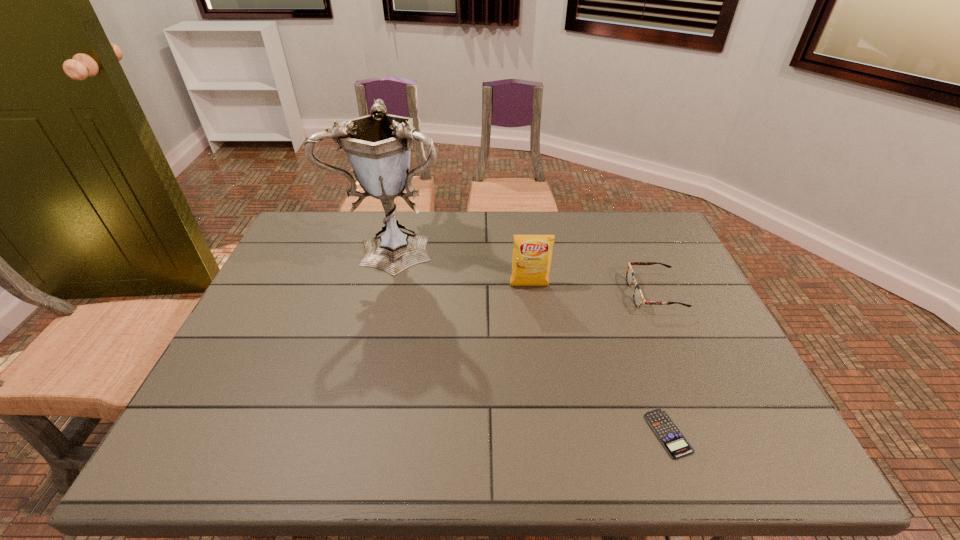
This screenshot has width=960, height=540. In the image, there is a desktop. In order to click on vacant space at the far right corner in this screenshot , I will do `click(651, 216)`.

You are a GUI agent. You are given a task and a screenshot of the screen. Output one action in this format:
    pyautogui.click(x=<x>, y=<y>)
    Task: Click on the free point between the leftmost object and the second object from left to right
    The width and height of the screenshot is (960, 540).
    Given the screenshot: What is the action you would take?
    pyautogui.click(x=463, y=265)

Identify the location of free spot between the calculator and the third object from right to left. (599, 360).

Find the location of a particular element. The image size is (960, 540). free point between the spectacles and the third shortest object is located at coordinates (591, 289).

The image size is (960, 540). Find the location of `vacant area that lies between the crisp (potato chip) and the second shortest object`. vacant area that lies between the crisp (potato chip) and the second shortest object is located at coordinates (591, 289).

Identify the location of empty space between the calculator and the tallest object. (533, 339).

I want to click on free space between the crisp (potato chip) and the trophy cup, so click(463, 265).

The height and width of the screenshot is (540, 960). I want to click on unoccupied position between the tallest object and the nearest object, so click(533, 339).

Find the location of a particular element. This screenshot has width=960, height=540. vacant region between the second shortest object and the calculator is located at coordinates (661, 363).

Identify the location of empty space between the second object from left to right and the trophy cup. (463, 265).